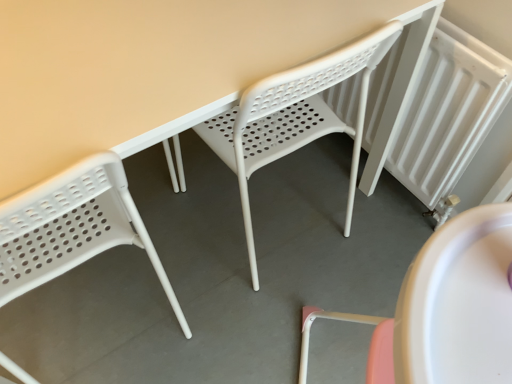
Question: In terms of size, does white plastic chair at center, which is counted as the second chair, starting from the left, appear bigger or smaller than white plastic chair at left, arranged as the 1th chair when viewed from the left?

Choices:
 (A) small
 (B) big

Answer: (B)

Question: In the image, is white plastic chair at center, which appears as the 1th chair when viewed from the right, on the left side or the right side of white plastic chair at left, arranged as the 1th chair when viewed from the left?

Choices:
 (A) left
 (B) right

Answer: (B)

Question: Which of these objects is positioned farthest from the white plastic chair at center, which appears as the 1th chair when viewed from the right?

Choices:
 (A) white textured radiator at right
 (B) white plastic chair at left, arranged as the 1th chair when viewed from the left

Answer: (B)

Question: Which of these objects is positioned farthest from the white plastic chair at left, arranged as the 1th chair when viewed from the left?

Choices:
 (A) white textured radiator at right
 (B) white plastic chair at center, which is counted as the second chair, starting from the left

Answer: (A)